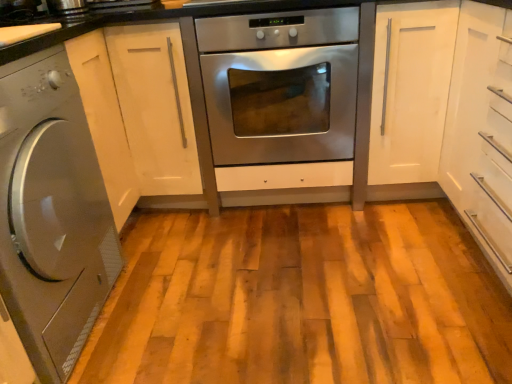
Question: From a real-world perspective, is stainless steel oven at center above or below white glossy cabinet at center, arranged as the second cabinetry when viewed from the right?

Choices:
 (A) above
 (B) below

Answer: (B)

Question: Based on their sizes in the image, would you say stainless steel oven at center is bigger or smaller than white glossy cabinet at center, arranged as the second cabinetry when viewed from the right?

Choices:
 (A) small
 (B) big

Answer: (A)

Question: Which is farther from the white glossy cabinet at center, arranged as the second cabinetry when viewed from the right?

Choices:
 (A) satin silver washing machine at left
 (B) white matte cabinet at right, which is counted as the 2th cabinetry, starting from the left
 (C) stainless steel oven at center

Answer: (B)

Question: Estimate the real-world distances between objects in this image. Which object is farther from the white glossy cabinet at center, arranged as the second cabinetry when viewed from the right?

Choices:
 (A) satin silver washing machine at left
 (B) stainless steel oven at center
 (C) white matte cabinet at right, which is counted as the 2th cabinetry, starting from the left

Answer: (C)